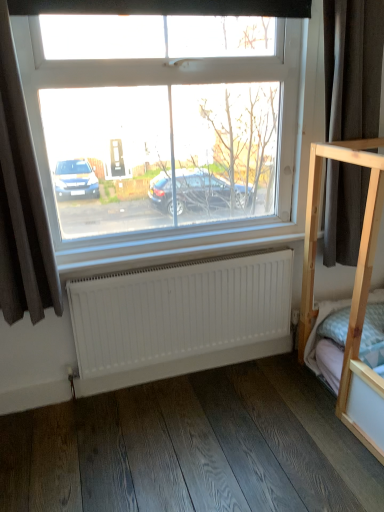
Question: From a real-world perspective, is brown fabric curtain at left, which is the 1th curtain in left-to-right order, positioned over white matte radiator at lower center based on gravity?

Choices:
 (A) yes
 (B) no

Answer: (A)

Question: From a real-world perspective, is brown fabric curtain at left, the 2th curtain viewed from the right, below white matte radiator at lower center?

Choices:
 (A) no
 (B) yes

Answer: (A)

Question: Does brown fabric curtain at left, the 2th curtain viewed from the right, come in front of white matte radiator at lower center?

Choices:
 (A) no
 (B) yes

Answer: (B)

Question: Are brown fabric curtain at left, the 2th curtain viewed from the right, and white matte radiator at lower center located far from each other?

Choices:
 (A) yes
 (B) no

Answer: (B)

Question: From the image's perspective, is brown fabric curtain at left, which is the 1th curtain in left-to-right order, beneath white matte radiator at lower center?

Choices:
 (A) yes
 (B) no

Answer: (B)

Question: Considering the relative sizes of brown fabric curtain at left, which is the 1th curtain in left-to-right order, and white matte radiator at lower center in the image provided, is brown fabric curtain at left, which is the 1th curtain in left-to-right order, thinner than white matte radiator at lower center?

Choices:
 (A) yes
 (B) no

Answer: (B)

Question: Is dark wood flooring at lower center not inside white matte radiator at lower center?

Choices:
 (A) no
 (B) yes

Answer: (B)

Question: Is dark wood flooring at lower center thinner than white matte radiator at lower center?

Choices:
 (A) yes
 (B) no

Answer: (B)

Question: Considering the relative positions of dark wood flooring at lower center and white matte radiator at lower center in the image provided, is dark wood flooring at lower center to the right of white matte radiator at lower center from the viewer's perspective?

Choices:
 (A) no
 (B) yes

Answer: (B)

Question: Does dark wood flooring at lower center have a lesser height compared to white matte radiator at lower center?

Choices:
 (A) yes
 (B) no

Answer: (A)

Question: Does dark wood flooring at lower center have a larger size compared to white matte radiator at lower center?

Choices:
 (A) no
 (B) yes

Answer: (A)

Question: Does dark wood flooring at lower center lie in front of white matte radiator at lower center?

Choices:
 (A) yes
 (B) no

Answer: (A)

Question: Does brown fabric curtain at left, the 2th curtain viewed from the right, have a lesser width compared to dark gray fabric at right, which is the 2th curtain in left-to-right order?

Choices:
 (A) yes
 (B) no

Answer: (B)